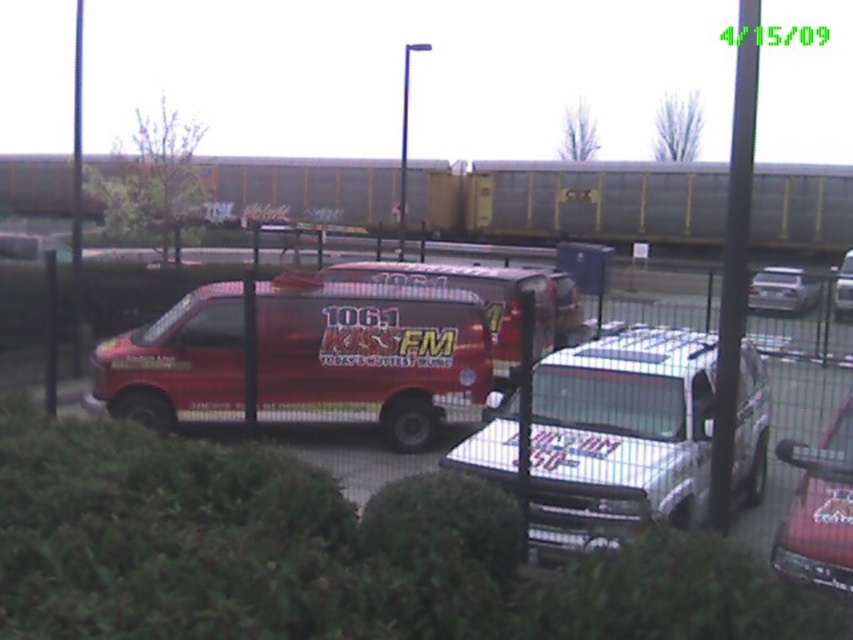
You are standing in the parking lot and want to take a photo of the shiny red van at center. To avoid including the green leafy hedge at lower center in your photo, which direction should you move relative to the van?

The green leafy hedge at lower center is to the left of the shiny red van at center. To avoid including it in your photo, you should move to the right side of the shiny red van at center.

You are a photographer trying to capture both the shiny red van at center and the metallic red van at center in a single shot. Which van should you position closer to the left side of your camera frame to include both?

You should position the shiny red van at center closer to the left side of your camera frame since it is already to the left of the metallic red van at center, ensuring both fit within the shot.

You are standing in the parking lot and want to take a photo of both the shiny red van at center and the metallic red van at center. Which van should you focus on first to ensure it appears closer in your photo?

You should focus on the shiny red van at center first because it is closer to you than the metallic red van at center, making it appear closer in the photo.